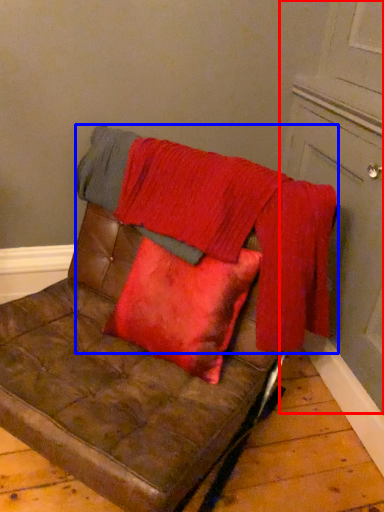
Question: Which of the following is the farthest to the observer, door (highlighted by a red box) or blanket (highlighted by a blue box)?

Choices:
 (A) door
 (B) blanket

Answer: (B)